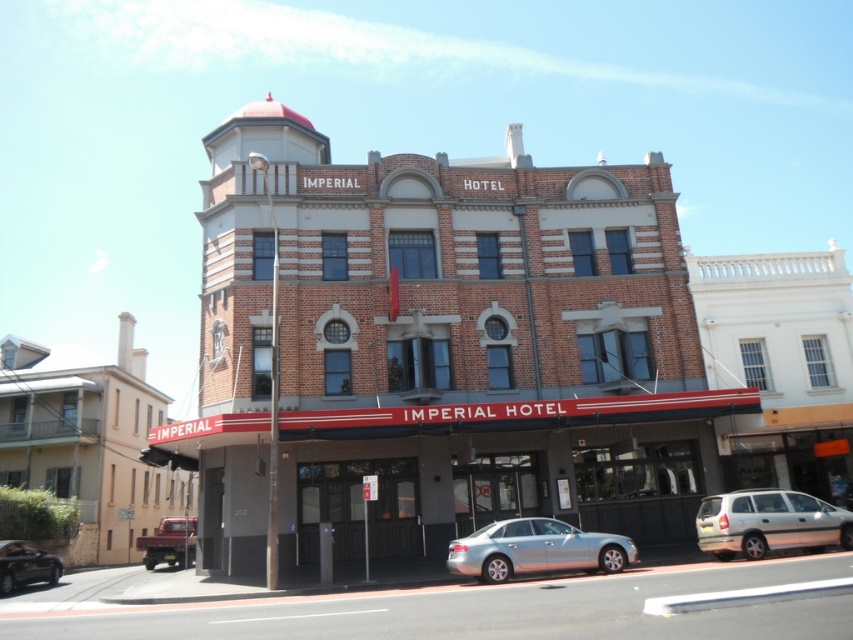
Question: Does beige brick building at lower left have a smaller size compared to silver metallic sedan at lower center?

Choices:
 (A) yes
 (B) no

Answer: (B)

Question: Which point is farther from the camera taking this photo?

Choices:
 (A) (160, 490)
 (B) (491, 560)
 (C) (775, 326)

Answer: (A)

Question: Which object is the closest to the silver metallic van at lower right?

Choices:
 (A) white smooth building at center
 (B) beige brick building at lower left
 (C) silver metallic sedan at lower center

Answer: (C)

Question: Does brown brick building at center appear on the left side of metallic silver sedan at lower left?

Choices:
 (A) no
 (B) yes

Answer: (A)

Question: Does beige brick building at lower left have a greater width compared to silver metallic van at lower right?

Choices:
 (A) yes
 (B) no

Answer: (A)

Question: Which point appears closest to the camera in this image?

Choices:
 (A) (183, 547)
 (B) (688, 422)
 (C) (161, 481)

Answer: (B)